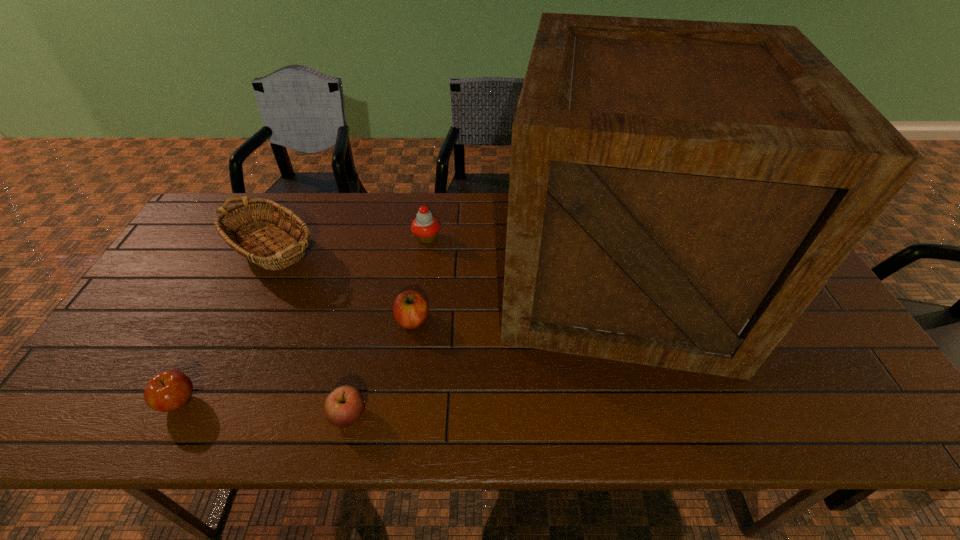
At what (x,y) coordinates should I click in order to perform the action: click on free space at the left edge of the desktop. Please return your answer as a coordinate pair (x, y). The height and width of the screenshot is (540, 960). Looking at the image, I should click on (133, 330).

Find the location of a particular element. vacant space at the right edge of the desktop is located at coordinates (815, 320).

Locate an element on the screen. free point between the third tallest object and the leftmost apple is located at coordinates (303, 320).

Find the location of a particular element. Image resolution: width=960 pixels, height=540 pixels. vacant area that lies between the leftmost apple and the second tallest object is located at coordinates (226, 330).

Identify the location of free space between the basket and the leftmost apple. [226, 330].

Where is `free space between the box and the third object from left to right`? The height and width of the screenshot is (540, 960). free space between the box and the third object from left to right is located at coordinates (483, 345).

Find the location of a particular element. vacant area between the leftmost apple and the third object from left to right is located at coordinates (264, 408).

Where is `free spot between the rightmost object and the leftmost apple`? This screenshot has height=540, width=960. free spot between the rightmost object and the leftmost apple is located at coordinates (398, 339).

Where is `free spot between the cupcake and the second apple from right to left`? free spot between the cupcake and the second apple from right to left is located at coordinates (388, 326).

Where is `free space between the basket and the rightmost object`? Image resolution: width=960 pixels, height=540 pixels. free space between the basket and the rightmost object is located at coordinates (444, 267).